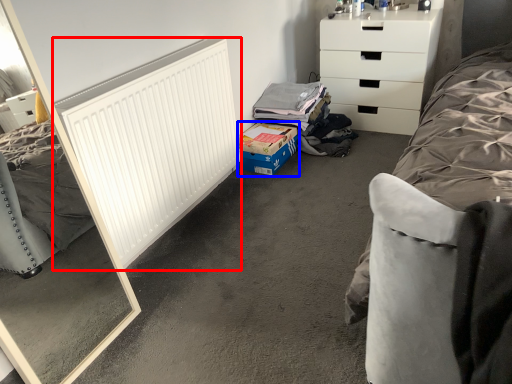
Question: Which object appears farthest to the camera in this image, radiator (highlighted by a red box) or cardboard box (highlighted by a blue box)?

Choices:
 (A) radiator
 (B) cardboard box

Answer: (B)